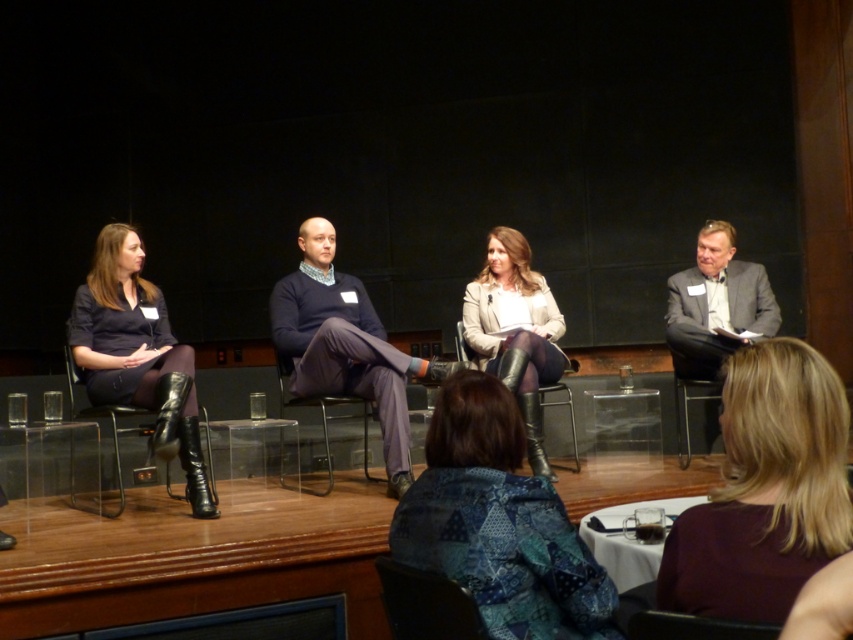
Question: Which point is farther from the camera taking this photo?

Choices:
 (A) pyautogui.click(x=335, y=355)
 (B) pyautogui.click(x=318, y=337)
 (C) pyautogui.click(x=721, y=349)
 (D) pyautogui.click(x=192, y=365)

Answer: (C)

Question: Which of the following is the farthest from the observer?

Choices:
 (A) (477, 349)
 (B) (473, 561)
 (C) (729, 305)

Answer: (C)

Question: Is matte gray blazer at center to the left of metallic silver chair at center from the viewer's perspective?

Choices:
 (A) no
 (B) yes

Answer: (A)

Question: Does blue textured coat at center lie in front of clear plastic chair at center?

Choices:
 (A) yes
 (B) no

Answer: (A)

Question: Estimate the real-world distances between objects in this image. Which object is closer to the blue textured coat at center?

Choices:
 (A) matte black chair at lower center
 (B) matte blue sweater at center
 (C) blonde hair at center
 (D) clear plastic chair at center

Answer: (A)

Question: Can you confirm if blonde hair at center is positioned above matte gray blazer at center?

Choices:
 (A) no
 (B) yes

Answer: (A)